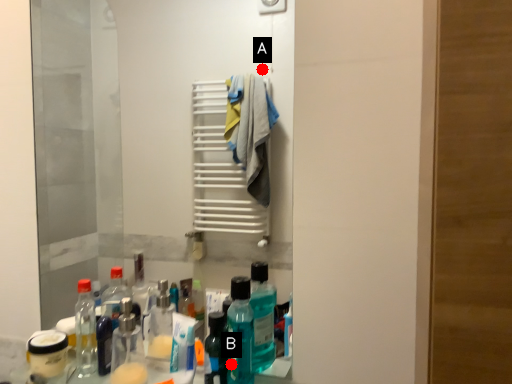
Question: Two points are circled on the image, labeled by A and B beside each circle. Which point is farther to the camera?

Choices:
 (A) A is further
 (B) B is further

Answer: (A)